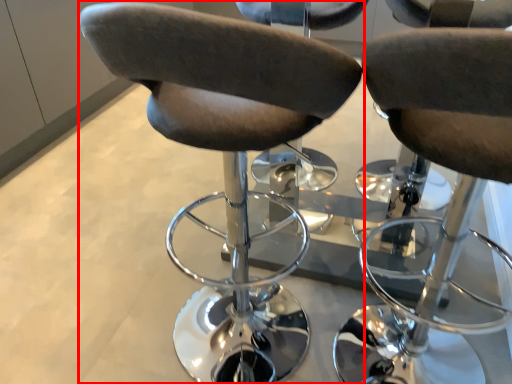
Question: From the image's perspective, what is the correct spatial positioning of chair (annotated by the red box) in reference to chair?

Choices:
 (A) above
 (B) below

Answer: (A)